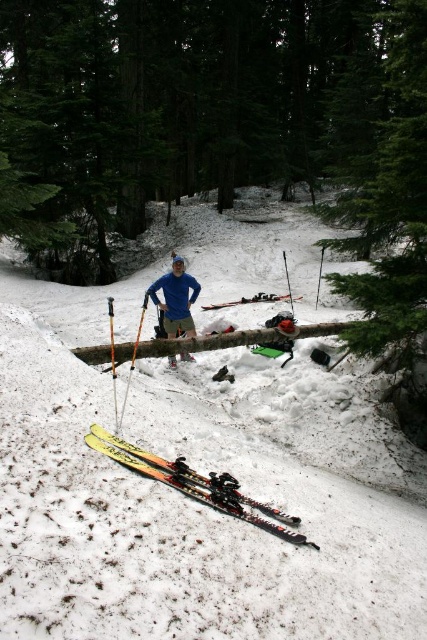
Does green matte tree at center appear on the right side of yellow plastic ski pole at center?

No, green matte tree at center is not to the right of yellow plastic ski pole at center.

Looking at this image, measure the distance between green matte tree at center and camera.

The distance of green matte tree at center from camera is 4.85 meters.

Which is in front, point (318, 12) or point (110, 342)?

Point (110, 342)

Where is `green matte tree at center`? Image resolution: width=427 pixels, height=640 pixels. green matte tree at center is located at coordinates (222, 124).

Between white fluffy snow at center and yellow plastic ski pole at center, which one has less height?

With less height is yellow plastic ski pole at center.

Is white fluffy snow at center to the right of yellow plastic ski pole at center from the viewer's perspective?

Correct, you'll find white fluffy snow at center to the right of yellow plastic ski pole at center.

Between point (187, 541) and point (114, 381), which one is positioned behind?

The point (114, 381) is more distant.

Image resolution: width=427 pixels, height=640 pixels. I want to click on white fluffy snow at center, so click(199, 467).

Between yellow matte skis at lower left and blue fabric pants at center, which one is positioned higher?

blue fabric pants at center

Consider the image. Can you confirm if yellow matte skis at lower left is positioned above blue fabric pants at center?

No.

Which is in front, point (207, 493) or point (177, 284)?

Point (207, 493)

Locate an element on the screen. The height and width of the screenshot is (640, 427). yellow matte skis at lower left is located at coordinates (195, 484).